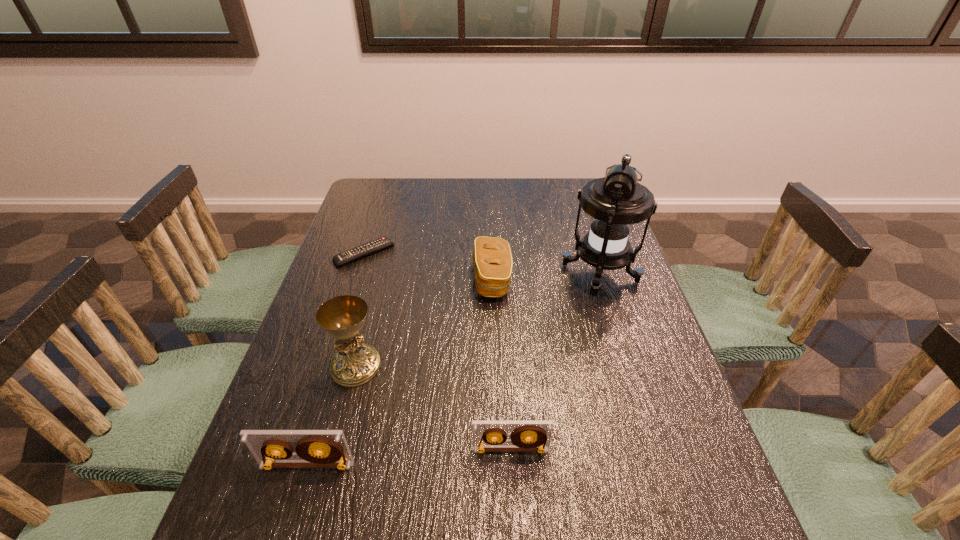
This screenshot has height=540, width=960. Find the location of `object present at the right edge`. object present at the right edge is located at coordinates (615, 202).

I want to click on object positioned at the near left corner, so click(316, 448).

Find the location of `vacant space at the far edge of the desktop`. vacant space at the far edge of the desktop is located at coordinates (514, 188).

In the image, there is a desktop. At what (x,y) coordinates should I click in order to perform the action: click on blank space at the near edge. Please return your answer as a coordinate pair (x, y). Looking at the image, I should click on (636, 501).

Where is `free space at the right edge`? free space at the right edge is located at coordinates (657, 417).

In order to click on vacant space at the far left corner of the desktop in this screenshot , I will do `click(378, 192)`.

This screenshot has height=540, width=960. Find the location of `vacant space at the near right corner of the desktop`. vacant space at the near right corner of the desktop is located at coordinates (693, 494).

You are a GUI agent. You are given a task and a screenshot of the screen. Output one action in this format:
    pyautogui.click(x=<x>, y=<y>)
    Task: Click on the unoccupied position between the third nearest object and the clutch bag
    
    Given the screenshot: What is the action you would take?
    pyautogui.click(x=424, y=322)

You are a GUI agent. You are given a task and a screenshot of the screen. Output one action in this format:
    pyautogui.click(x=<x>, y=<y>)
    Task: Click on the free space between the tallest object and the nearer videotape
    The width and height of the screenshot is (960, 540).
    Given the screenshot: What is the action you would take?
    pyautogui.click(x=453, y=369)

Image resolution: width=960 pixels, height=540 pixels. I want to click on unoccupied area between the second nearest object and the shortest object, so click(438, 352).